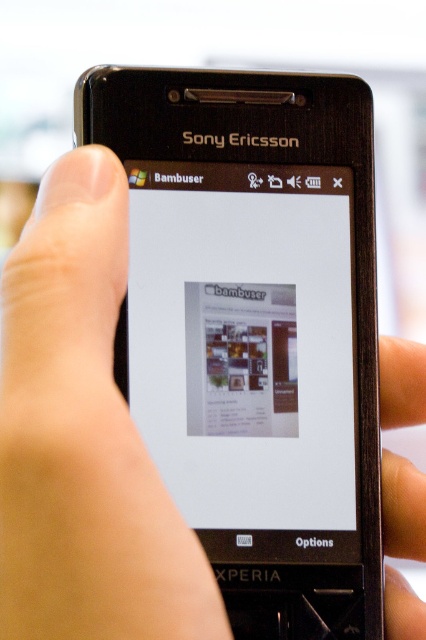
Question: Among these points, which one is farthest from the camera?

Choices:
 (A) (181, 266)
 (B) (419, 532)

Answer: (A)

Question: Does white glossy screen at center appear on the left side of skinny metallic finger at upper right?

Choices:
 (A) no
 (B) yes

Answer: (B)

Question: From the image, what is the correct spatial relationship of white glossy screen at center in relation to skinny metallic finger at upper right?

Choices:
 (A) right
 (B) left

Answer: (B)

Question: Which point is closer to the camera?

Choices:
 (A) skinny metallic finger at upper right
 (B) white glossy screen at center

Answer: (A)

Question: Among these points, which one is nearest to the camera?

Choices:
 (A) (184, 268)
 (B) (400, 512)

Answer: (B)

Question: Does white glossy screen at center appear on the right side of skinny metallic finger at upper right?

Choices:
 (A) no
 (B) yes

Answer: (A)